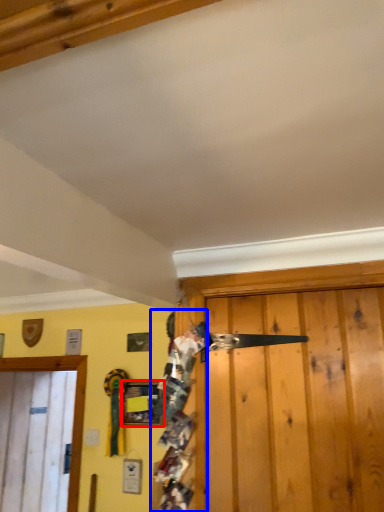
Question: Among these objects, which one is nearest to the camera, picture frame (highlighted by a red box) or person (highlighted by a blue box)?

Choices:
 (A) picture frame
 (B) person

Answer: (B)